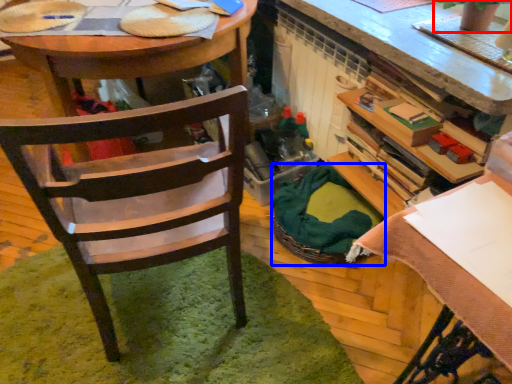
Question: Which object is further to the camera taking this photo, houseplant (highlighted by a red box) or picnic basket (highlighted by a blue box)?

Choices:
 (A) houseplant
 (B) picnic basket

Answer: (B)